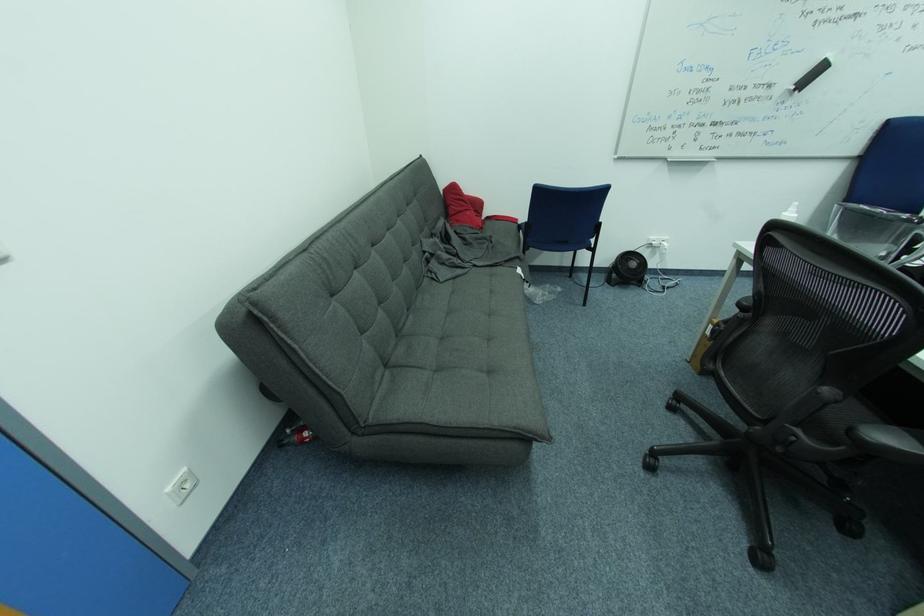
The location [626,269] corresponds to which object?

It corresponds to the small black fan in the image.